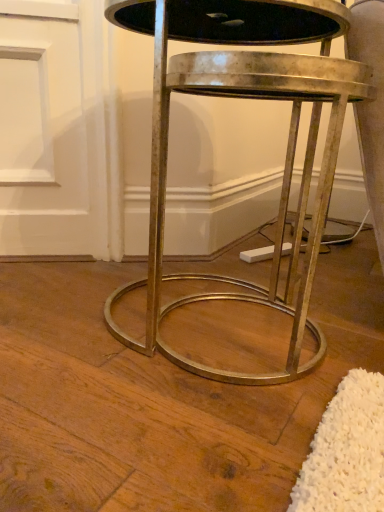
Describe the element at coordinates (244, 97) in the screenshot. I see `metallic gold table at center` at that location.

The width and height of the screenshot is (384, 512). In order to click on metallic gold table at center in this screenshot , I will do `click(244, 97)`.

Measure the distance between metallic gold table at center and camera.

The distance of metallic gold table at center from camera is 61.00 centimeters.

Identify the location of metallic gold table at center. Image resolution: width=384 pixels, height=512 pixels. (244, 97).